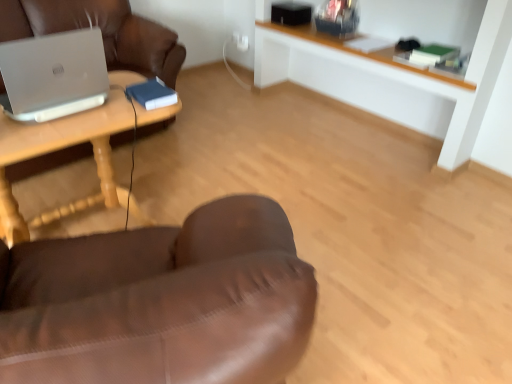
Question: Are white wood shelf at upper center and silver metallic laptop at left located far from each other?

Choices:
 (A) yes
 (B) no

Answer: (A)

Question: Does white wood shelf at upper center have a smaller size compared to silver metallic laptop at left?

Choices:
 (A) yes
 (B) no

Answer: (B)

Question: Is white wood shelf at upper center thinner than silver metallic laptop at left?

Choices:
 (A) no
 (B) yes

Answer: (A)

Question: From a real-world perspective, is white wood shelf at upper center below silver metallic laptop at left?

Choices:
 (A) no
 (B) yes

Answer: (B)

Question: Is white wood shelf at upper center outside silver metallic laptop at left?

Choices:
 (A) yes
 (B) no

Answer: (A)

Question: From the image's perspective, is white wood shelf at upper center under silver metallic laptop at left?

Choices:
 (A) yes
 (B) no

Answer: (B)

Question: Can you confirm if wooden table at left is bigger than white wood shelf at upper center?

Choices:
 (A) no
 (B) yes

Answer: (A)

Question: Would you say wooden table at left contains white wood shelf at upper center?

Choices:
 (A) no
 (B) yes

Answer: (A)

Question: Is wooden table at left not close to white wood shelf at upper center?

Choices:
 (A) no
 (B) yes

Answer: (B)

Question: From the image's perspective, does wooden table at left appear lower than white wood shelf at upper center?

Choices:
 (A) no
 (B) yes

Answer: (B)

Question: Is the depth of wooden table at left greater than that of white wood shelf at upper center?

Choices:
 (A) yes
 (B) no

Answer: (B)

Question: Does wooden table at left have a greater width compared to white wood shelf at upper center?

Choices:
 (A) yes
 (B) no

Answer: (A)

Question: Does wooden table at left touch silver metallic laptop at left?

Choices:
 (A) yes
 (B) no

Answer: (B)